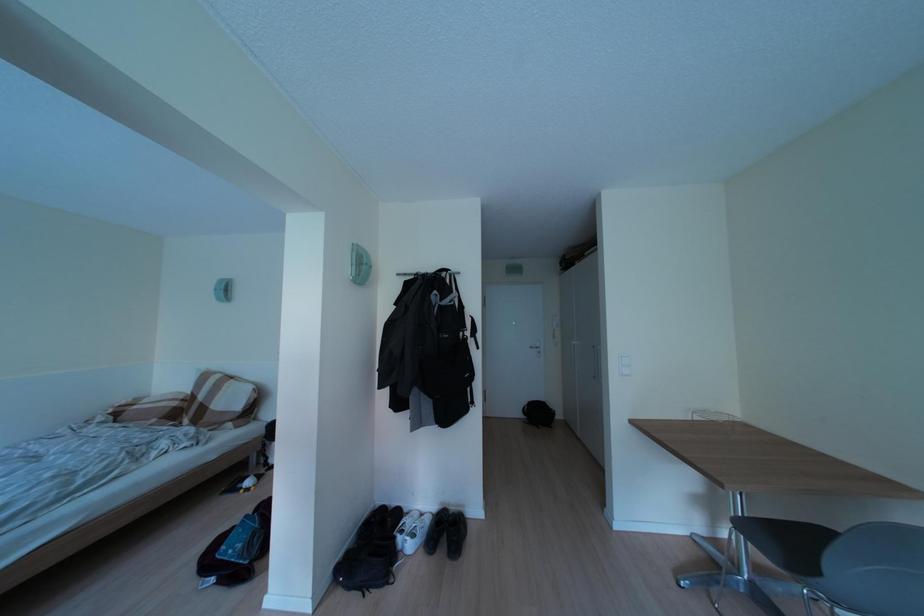
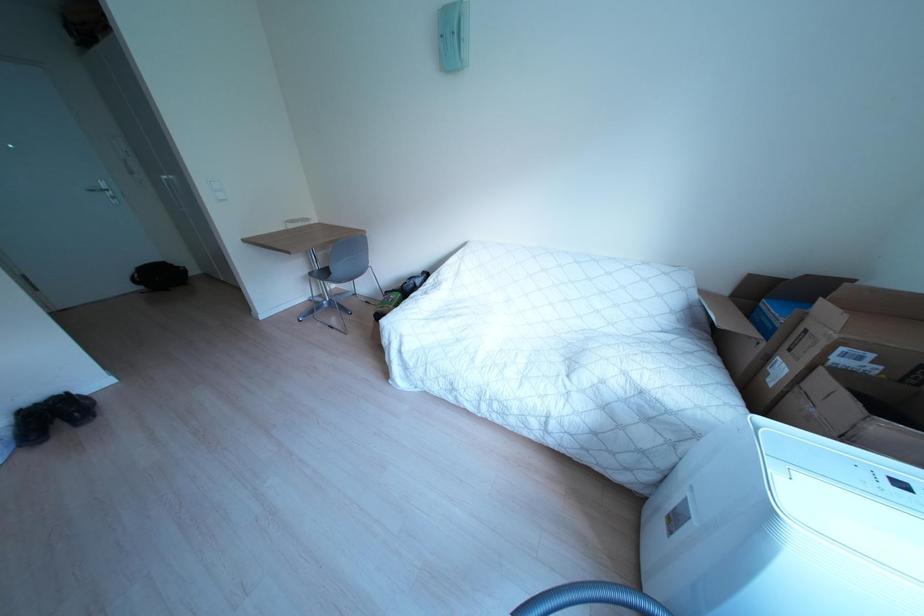
The first image is from the beginning of the video and the second image is from the end. How did the camera likely rotate when shooting the video?

The camera's rotation is toward right-down.